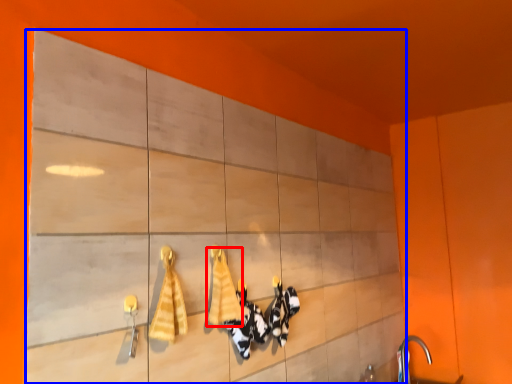
Question: Which object is closer to the camera taking this photo, bath towel (highlighted by a red box) or cabinetry (highlighted by a blue box)?

Choices:
 (A) bath towel
 (B) cabinetry

Answer: (B)